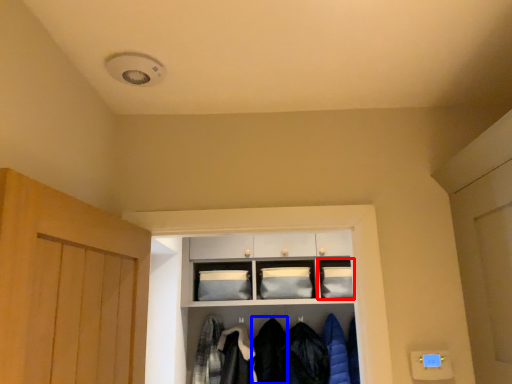
Question: Which of the following is the farthest to the observer, cabinet (highlighted by a red box) or clothing (highlighted by a blue box)?

Choices:
 (A) cabinet
 (B) clothing

Answer: (A)